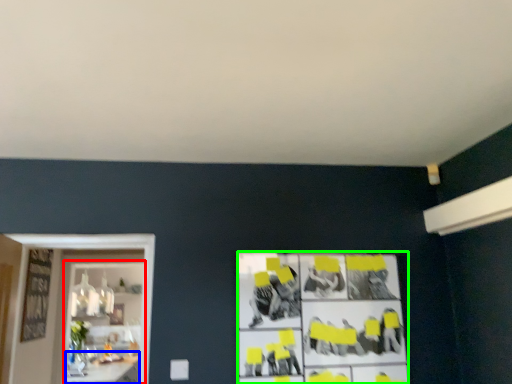
Question: Based on their relative distances, which object is farther from shelf (highlighted by a red box)? Choose from table (highlighted by a blue box) and poster (highlighted by a green box).

Choices:
 (A) table
 (B) poster

Answer: (B)